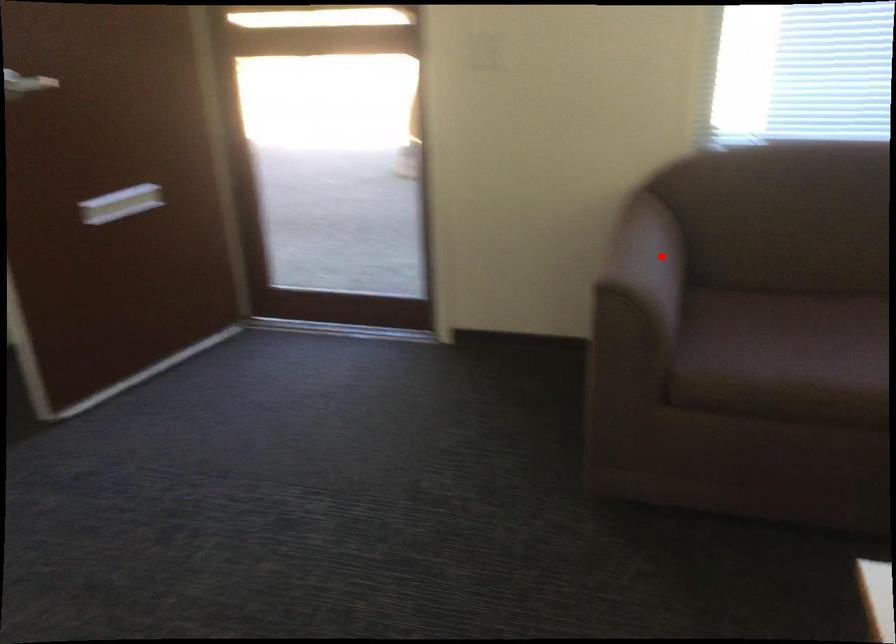
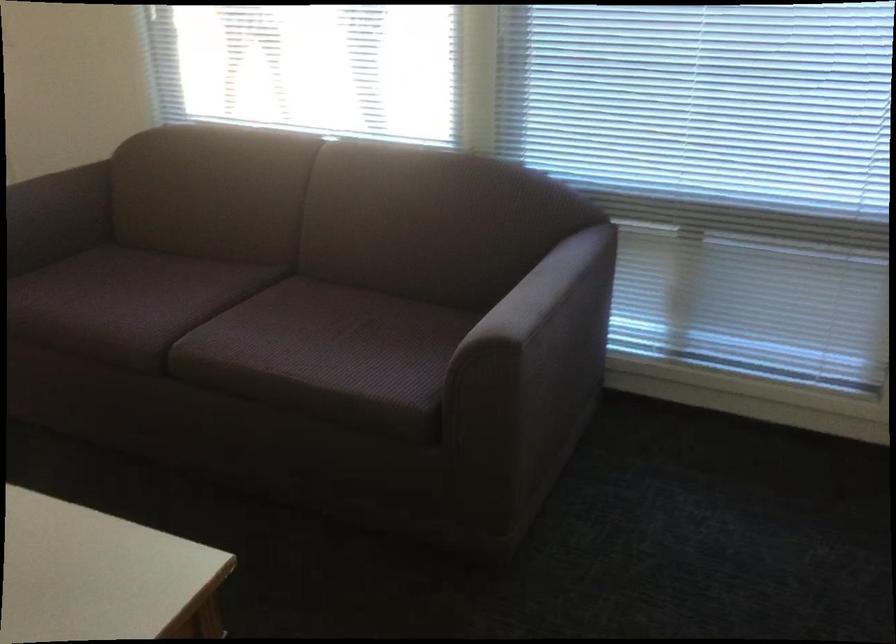
In the second image, find the point that corresponds to the highlighted location in the first image.

(56, 216)